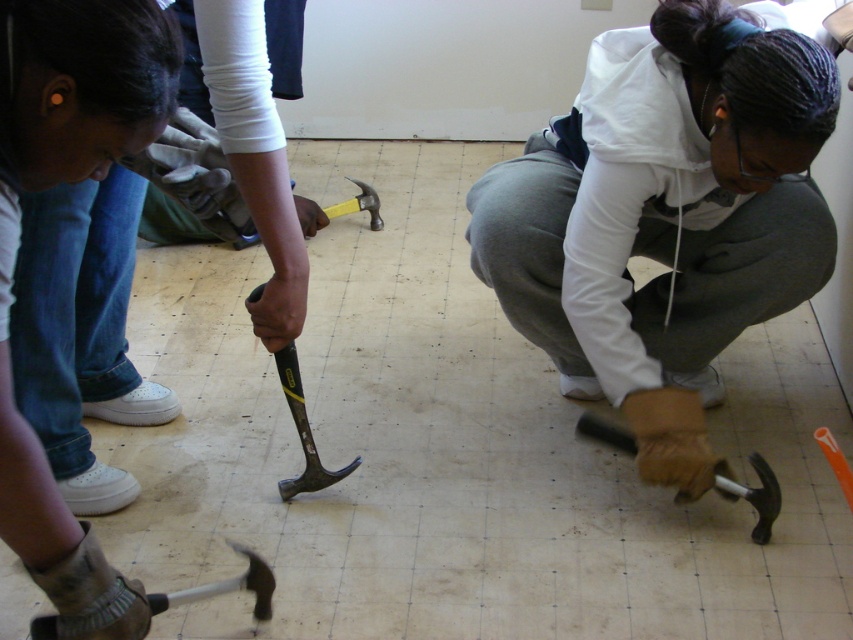
You are standing at the entrance of the room and want to move to the point labeled as point (322, 211). However, there is an obstacle at point (764, 522). Will you be able to walk directly to your destination without going around the obstacle?

Since point (764, 522) is in front of point (322, 211), the obstacle is blocking the path. Therefore, you will need to go around the obstacle to reach your destination.

You are a construction worker who needs to choose a hammer for a heavy duty task. The yellow rubber handle hammer at center and the black rubber hammer at center are available. Which one should you pick based on their sizes?

The yellow rubber handle hammer at center has a larger size compared to the black rubber hammer at center, so you should pick the yellow rubber handle hammer at center for heavy duty tasks.